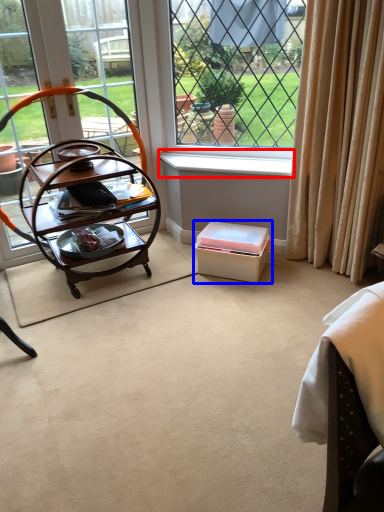
Question: Which object appears closest to the camera in this image, window sill (highlighted by a red box) or box (highlighted by a blue box)?

Choices:
 (A) window sill
 (B) box

Answer: (B)